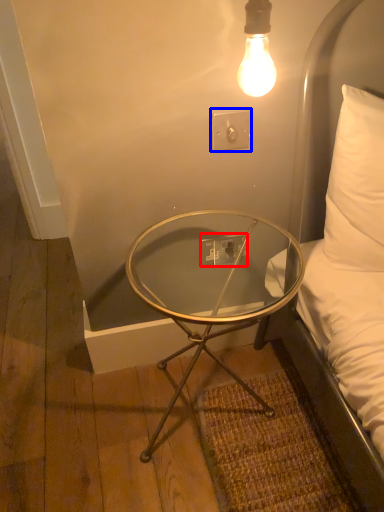
Question: Which point is further to the camera, electric outlet (highlighted by a red box) or electric outlet (highlighted by a blue box)?

Choices:
 (A) electric outlet
 (B) electric outlet

Answer: (A)